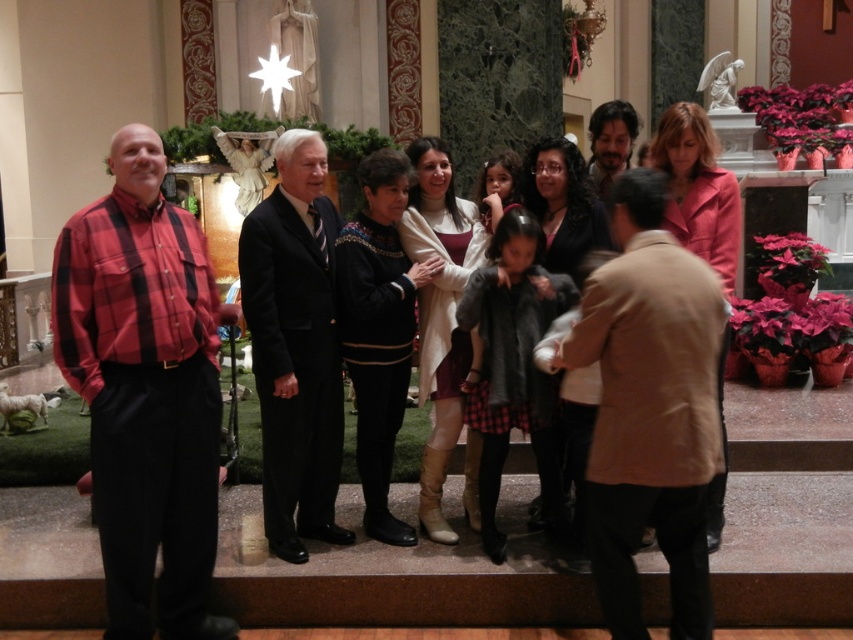
You are a photographer standing in front of the stage where the group is gathered. You need to capture a photo that includes both the tan leather jacket at center and the dark brown leather jacket at center. Which jacket should you focus on to ensure both are in frame without moving the camera?

The tan leather jacket at center is taller than the dark brown leather jacket at center, so focusing on the taller jacket will ensure both are in frame without needing to adjust the camera position.

You are a photographer positioned at the back of the stage. You need to capture a photo that includes both the plaid shirt at left and the dark suit at center. Given that your camera has a maximum focus range of 7 feet, will you be able to fit both subjects within the frame without moving closer?

The distance between the plaid shirt at left and the dark suit at center is 7.18 feet. Since your camera can only focus up to 7 feet, the subjects are slightly out of range. You may need to move closer or adjust your position to ensure both are within the 7 feet limit.